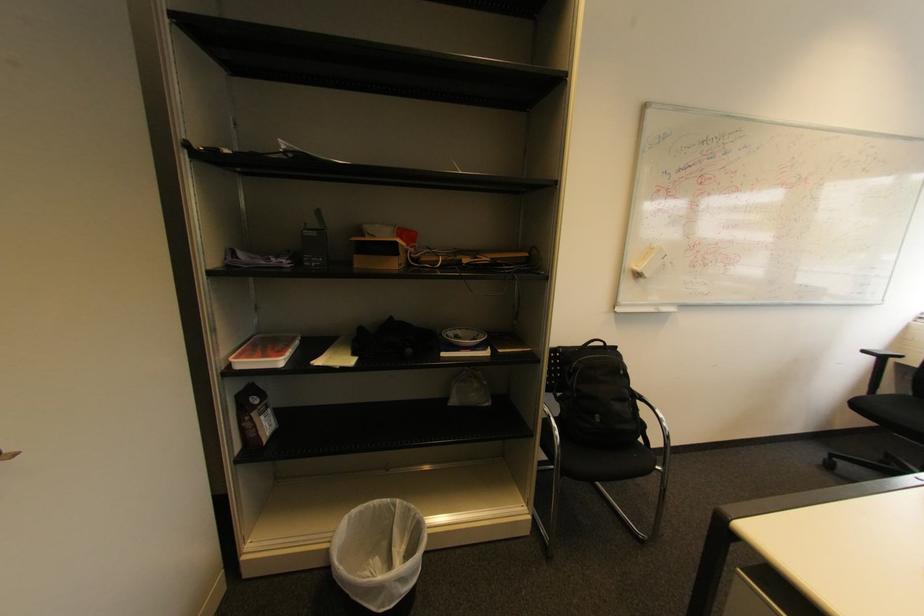
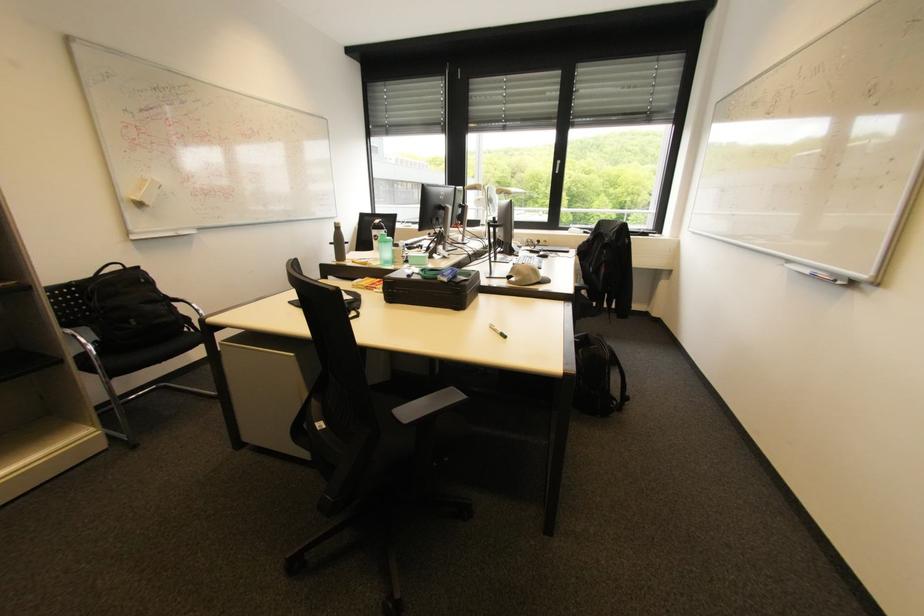
In the second image, find the point that corresponds to the point at 626,373 in the first image.

(148, 281)